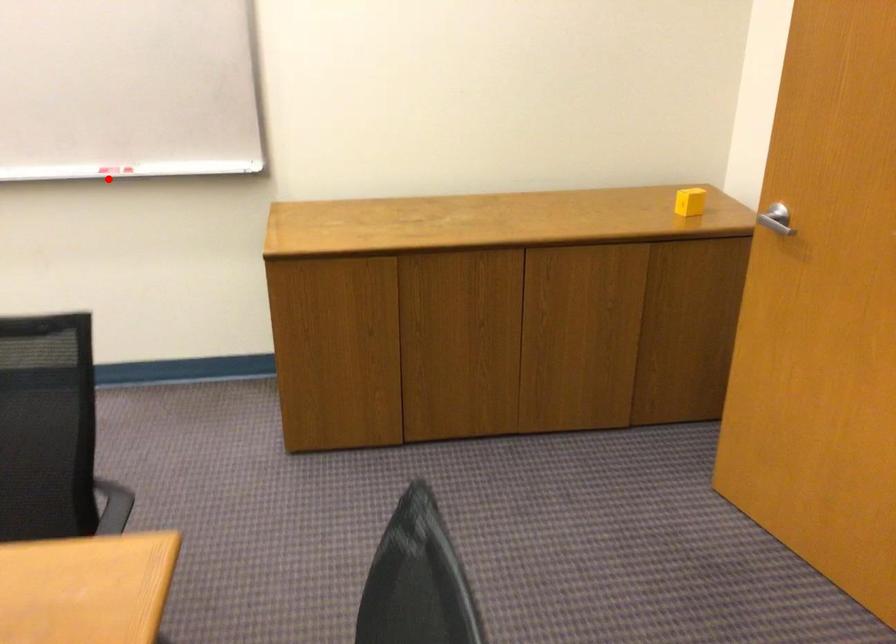
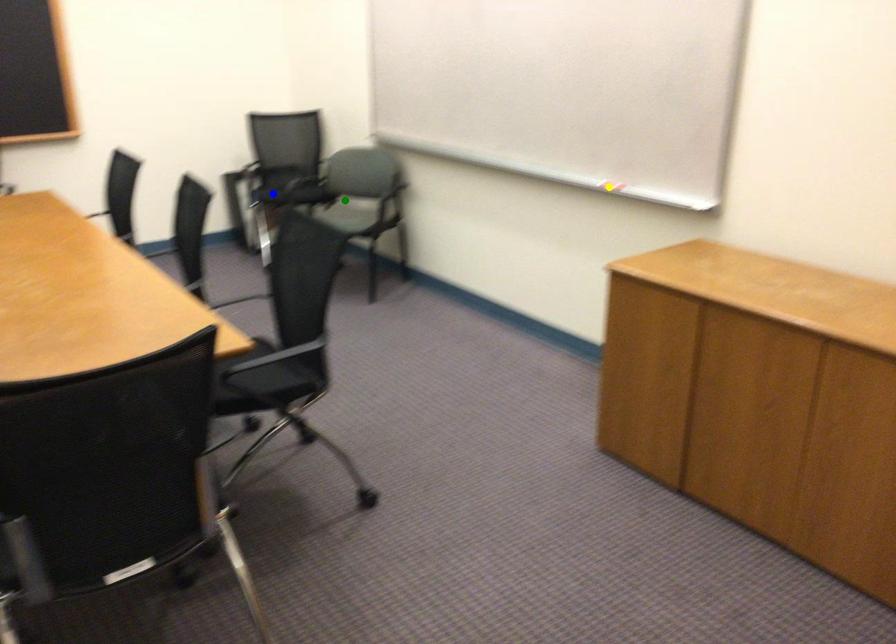
Question: I am providing you with two images of the same scene from different viewpoints. A red point is marked on the first image. You are given multiple points on the second image. Which point in image 2 is actually the same real-world point as the red point in image 1?

Choices:
 (A) blue point
 (B) yellow point
 (C) green point

Answer: (B)